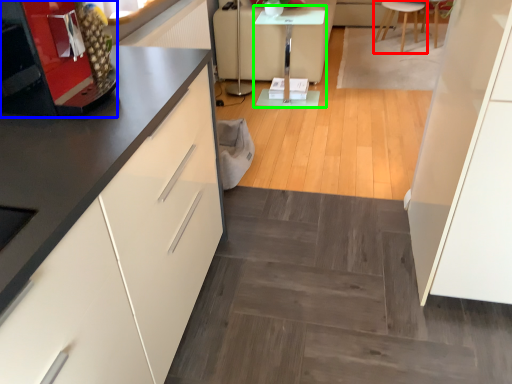
Question: Which object is the farthest from furniture (highlighted by a red box)? Choose among these: appliance (highlighted by a blue box) or table (highlighted by a green box).

Choices:
 (A) appliance
 (B) table

Answer: (A)